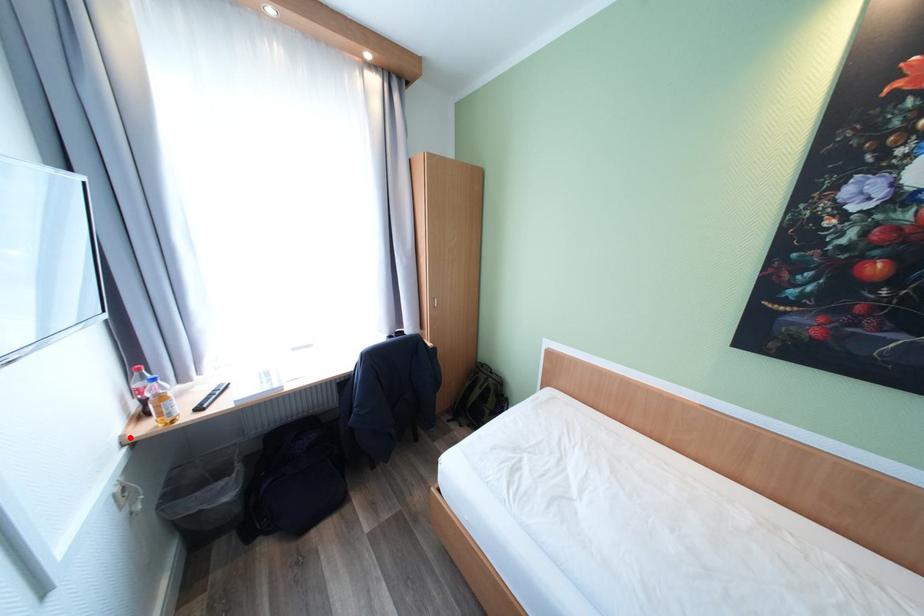
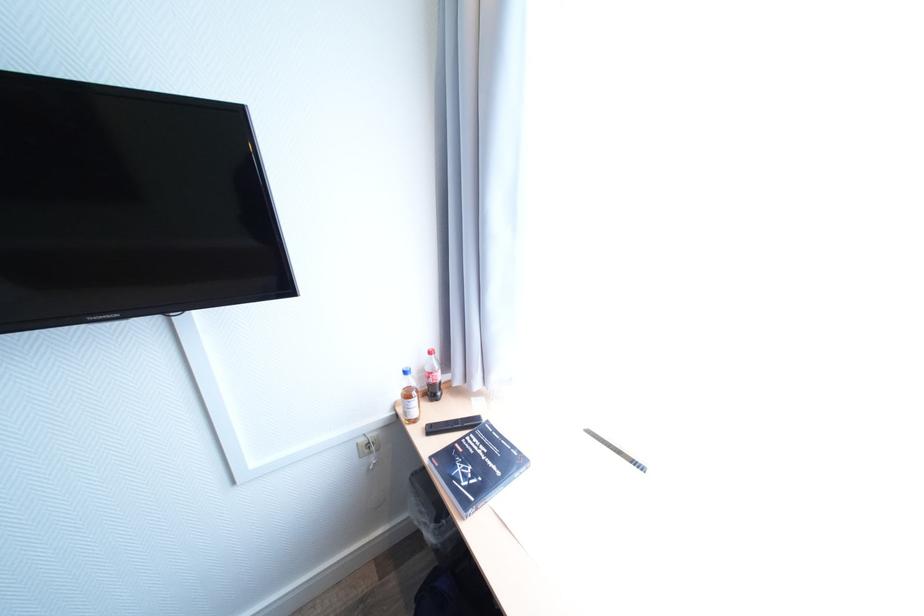
Question: I am providing you with two images of the same scene from different viewpoints. Image1 has a red point marked. In image2, the corresponding 3D location appears at what relative position? Reply with the corresponding letter.

Choices:
 (A) Closer
 (B) Farther

Answer: (B)